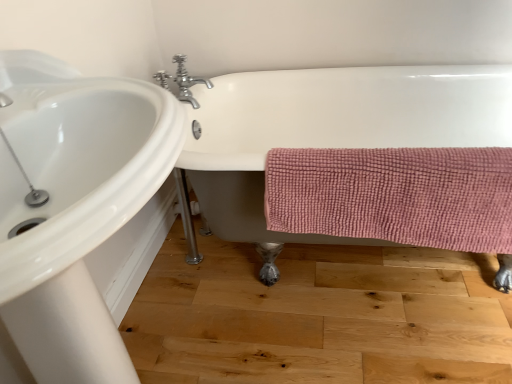
This screenshot has width=512, height=384. What are the coordinates of `vacant space behind chrome metallic faucet at upper center` in the screenshot? It's located at (210, 87).